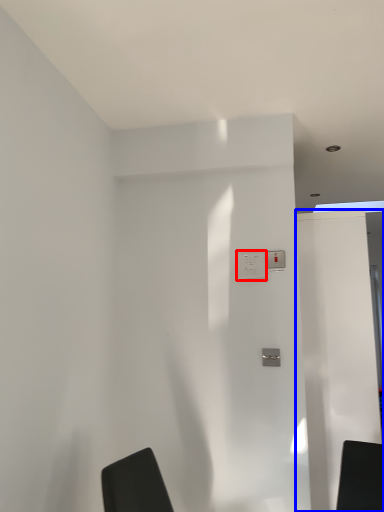
Question: Which point is closer to the camera, electric outlet (highlighted by a red box) or screen door (highlighted by a blue box)?

Choices:
 (A) electric outlet
 (B) screen door

Answer: (A)